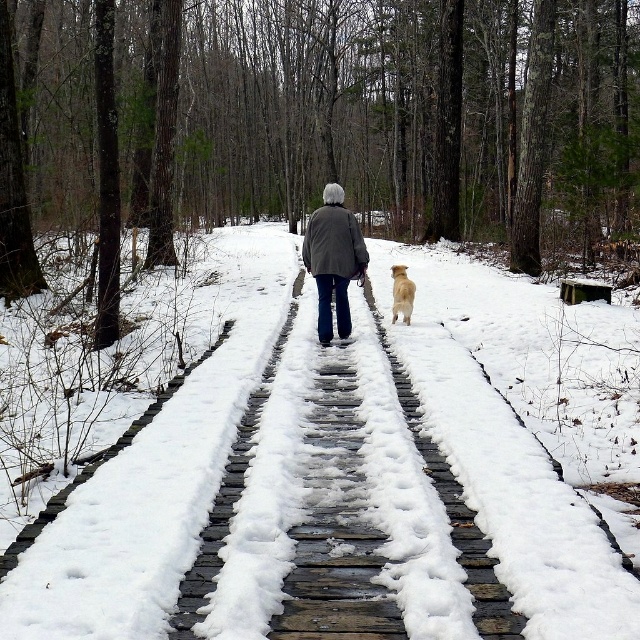
Question: Is white powder snow at center behind golden fur dog at center?

Choices:
 (A) no
 (B) yes

Answer: (A)

Question: Among these points, which one is nearest to the camera?

Choices:
 (A) (390, 394)
 (B) (344, 333)
 (C) (403, 285)

Answer: (A)

Question: Which point is farther to the camera?

Choices:
 (A) dark gray jacket at center
 (B) white powder snow at center
 (C) golden fur dog at center

Answer: (C)

Question: Which of the following is the farthest from the observer?

Choices:
 (A) (396, 307)
 (B) (316, 285)
 (C) (573, 509)

Answer: (B)

Question: Is white powder snow at center smaller than golden fur dog at center?

Choices:
 (A) no
 (B) yes

Answer: (A)

Question: In this image, where is white powder snow at center located relative to golden fur dog at center?

Choices:
 (A) above
 (B) below

Answer: (B)